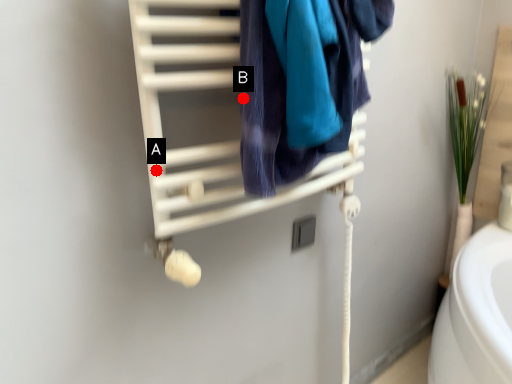
Question: Two points are circled on the image, labeled by A and B beside each circle. Which of the following is the closest to the observer?

Choices:
 (A) A is closer
 (B) B is closer

Answer: (B)